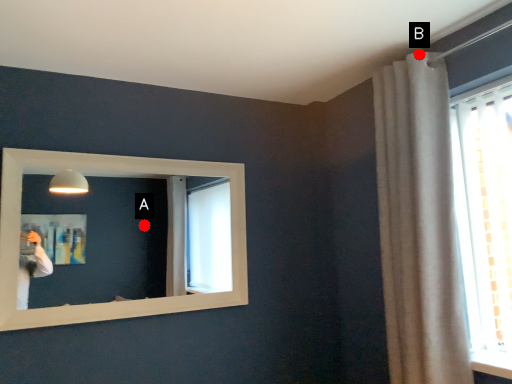
Question: Two points are circled on the image, labeled by A and B beside each circle. Which point appears farthest from the camera in this image?

Choices:
 (A) A is further
 (B) B is further

Answer: (A)